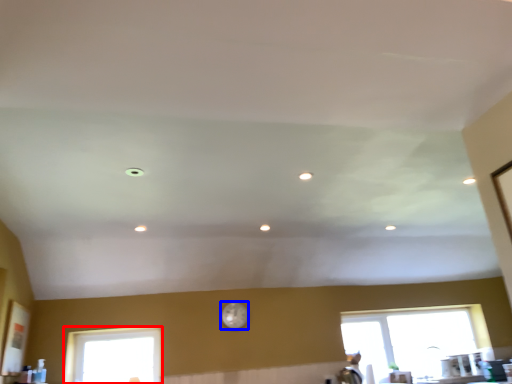
Question: Which object is further to the camera taking this photo, window (highlighted by a red box) or clock (highlighted by a blue box)?

Choices:
 (A) window
 (B) clock

Answer: (B)